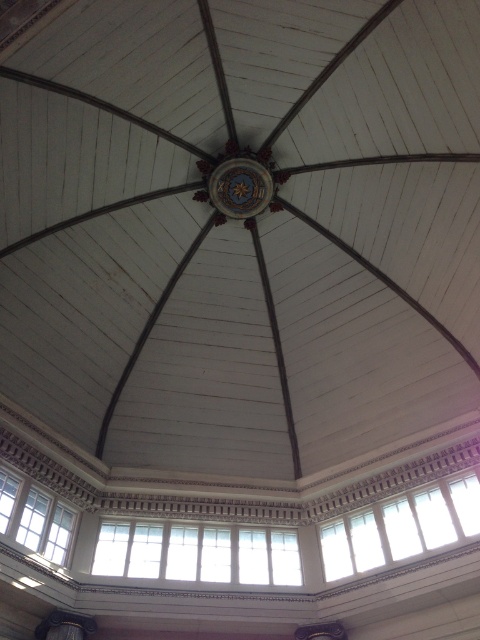
Question: Which object appears closest to the camera in this image?

Choices:
 (A) white glass windows at center
 (B) white glass window at lower center

Answer: (B)

Question: Can you confirm if white glass windows at center is positioned above white glass window at lower center?

Choices:
 (A) yes
 (B) no

Answer: (B)

Question: Can you confirm if white glass windows at center is positioned above white glass window at lower center?

Choices:
 (A) yes
 (B) no

Answer: (B)

Question: Can you confirm if white glass windows at center is wider than gold metallic clock at center?

Choices:
 (A) no
 (B) yes

Answer: (B)

Question: Which object is farther from the camera taking this photo?

Choices:
 (A) gold metallic clock at center
 (B) white glass window at lower center
 (C) white glass windows at center
 (D) clear glass windows at lower left

Answer: (A)

Question: Which point is closer to the camera?

Choices:
 (A) (220, 172)
 (B) (32, 497)

Answer: (B)